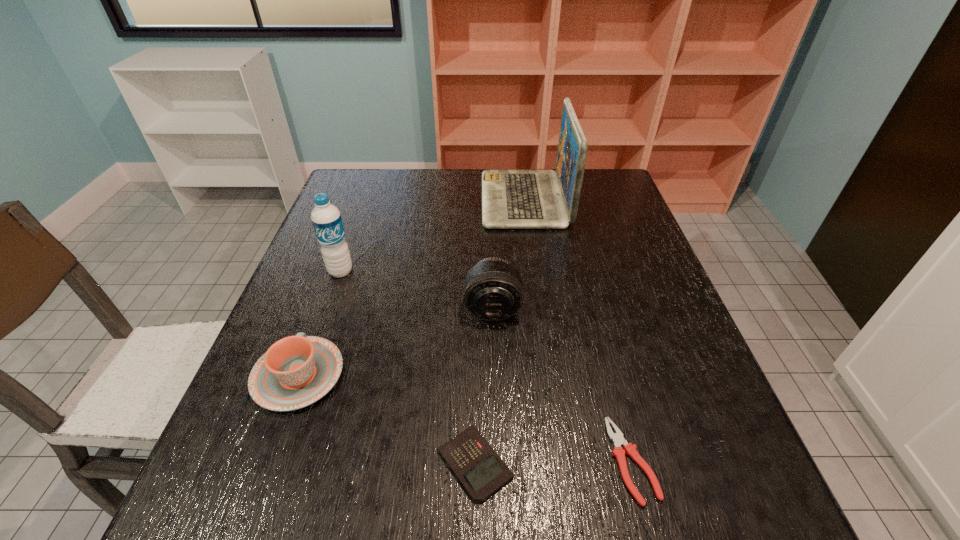
The image size is (960, 540). What are the coordinates of `object present at the far edge` in the screenshot? It's located at (511, 199).

Locate an element on the screen. The image size is (960, 540). calculator that is at the near edge is located at coordinates (481, 471).

Identify the location of pliers present at the near edge. (617, 438).

Find the location of a particular element. water bottle that is positioned at the left edge is located at coordinates (326, 218).

Locate an element on the screen. Image resolution: width=960 pixels, height=540 pixels. chinaware present at the left edge is located at coordinates (296, 371).

Find the location of a particular element. object that is positioned at the right edge is located at coordinates (617, 438).

Identify the location of object situated at the near right corner. The width and height of the screenshot is (960, 540). (617, 438).

This screenshot has width=960, height=540. I want to click on vacant space at the near edge of the desktop, so click(413, 524).

Find the location of a particular element. Image resolution: width=960 pixels, height=540 pixels. blank space at the left edge is located at coordinates (292, 482).

Where is `vacant region at the right edge of the desktop`? The height and width of the screenshot is (540, 960). vacant region at the right edge of the desktop is located at coordinates (636, 235).